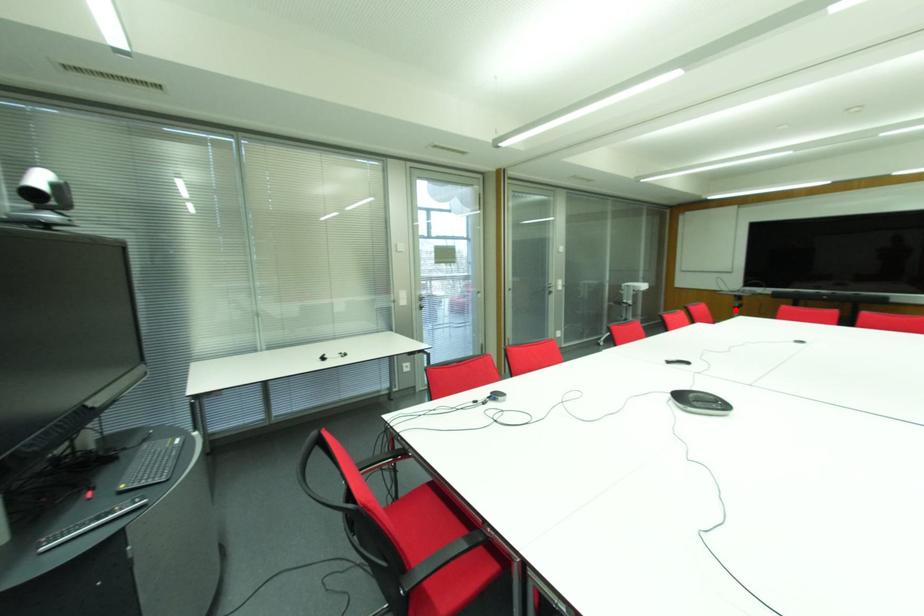
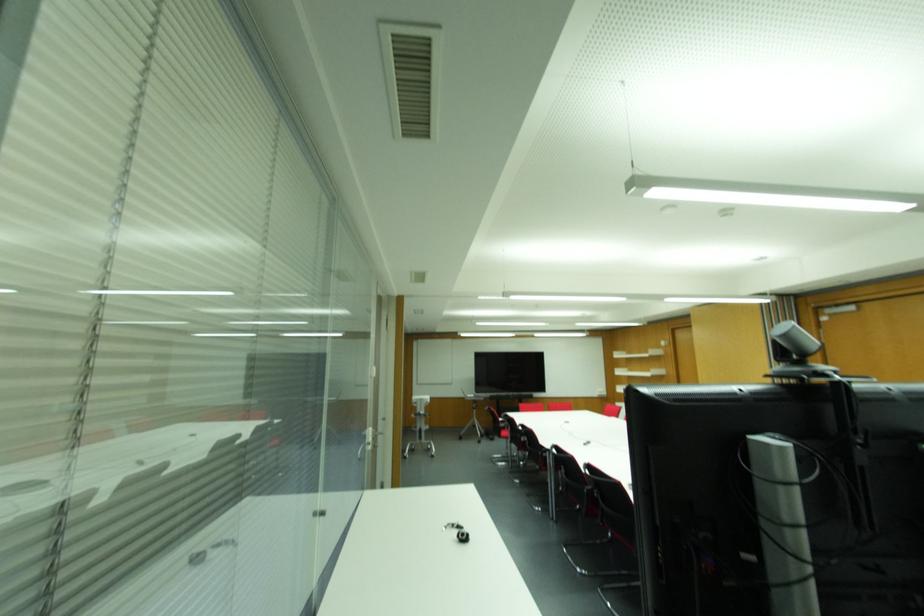
Question: I am providing you with two images of the same scene from different viewpoints. A red point is shown in image1. For the corresponding object point in image2, is it positioned nearer or farther from the camera?

Choices:
 (A) Nearer
 (B) Farther

Answer: (B)